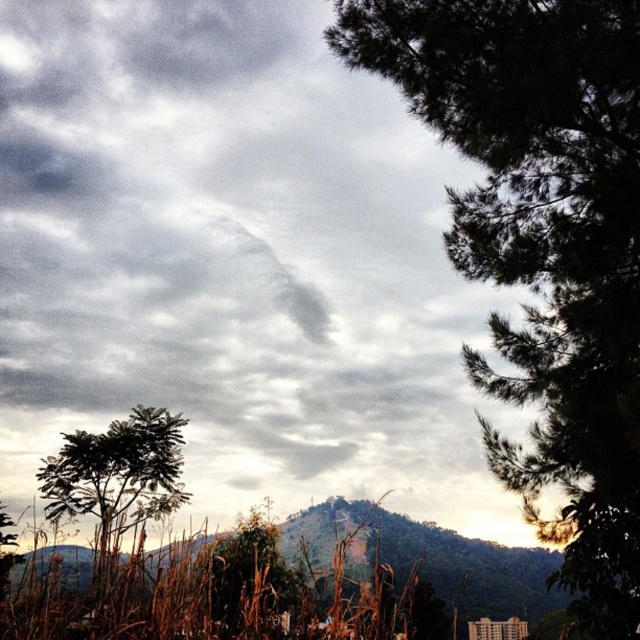
Does green textured hill at center have a larger size compared to green matte tree at lower center?

Indeed, green textured hill at center has a larger size compared to green matte tree at lower center.

Image resolution: width=640 pixels, height=640 pixels. In order to click on green textured hill at center in this screenshot , I will do `click(428, 557)`.

Image resolution: width=640 pixels, height=640 pixels. In order to click on green textured hill at center in this screenshot , I will do `click(428, 557)`.

Who is taller, green leafy tree at lower left or green matte tree at lower center?

green matte tree at lower center is taller.

Does green leafy tree at lower left appear on the right side of green matte tree at lower center?

No, green leafy tree at lower left is not to the right of green matte tree at lower center.

Describe the element at coordinates (116, 481) in the screenshot. I see `green leafy tree at lower left` at that location.

Image resolution: width=640 pixels, height=640 pixels. Find the location of `green leafy tree at lower left`. green leafy tree at lower left is located at coordinates (116, 481).

Which is below, green textured hill at center or green leafy tree at lower left?

green textured hill at center

What do you see at coordinates (428, 557) in the screenshot? This screenshot has width=640, height=640. I see `green textured hill at center` at bounding box center [428, 557].

This screenshot has height=640, width=640. I want to click on green textured hill at center, so click(428, 557).